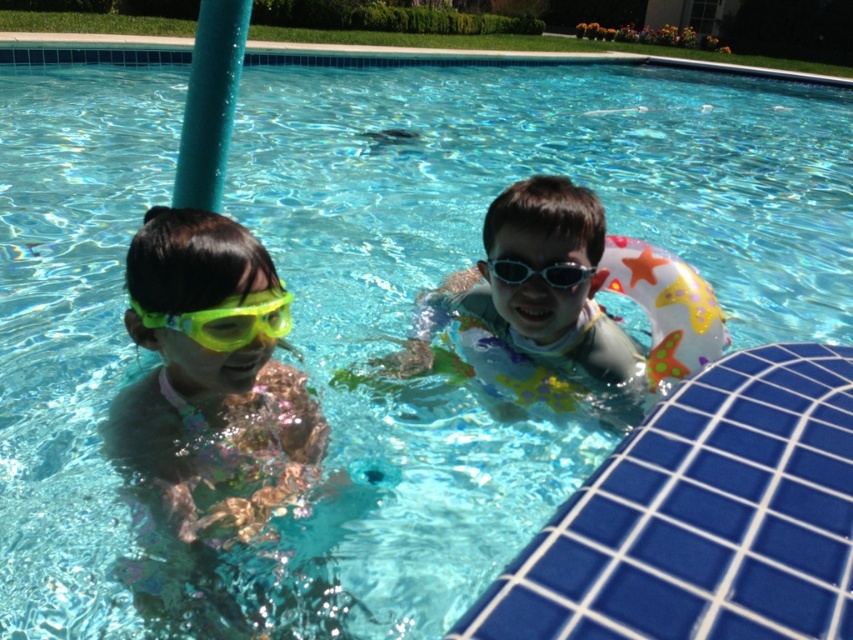
You are standing at the edge of the pool and want to throw a ball to the child with the goggles. The ball will land at point (132, 305). However, there is a floating toy at point (573, 264). Will the ball hit the floating toy before reaching the child?

Point (132, 305) is in front of point (573, 264), so the ball will reach the child with the goggles before hitting the floating toy at point (573, 264).

You are a photographer standing 2 meters away from the translucent rubber ring at center. You want to take a clear photo of it. Should you move closer or farther away?

The translucent rubber ring at center is 1.57 meters away from the camera. Since you are currently 2 meters away, you should move closer to the ring to get a clearer photo.